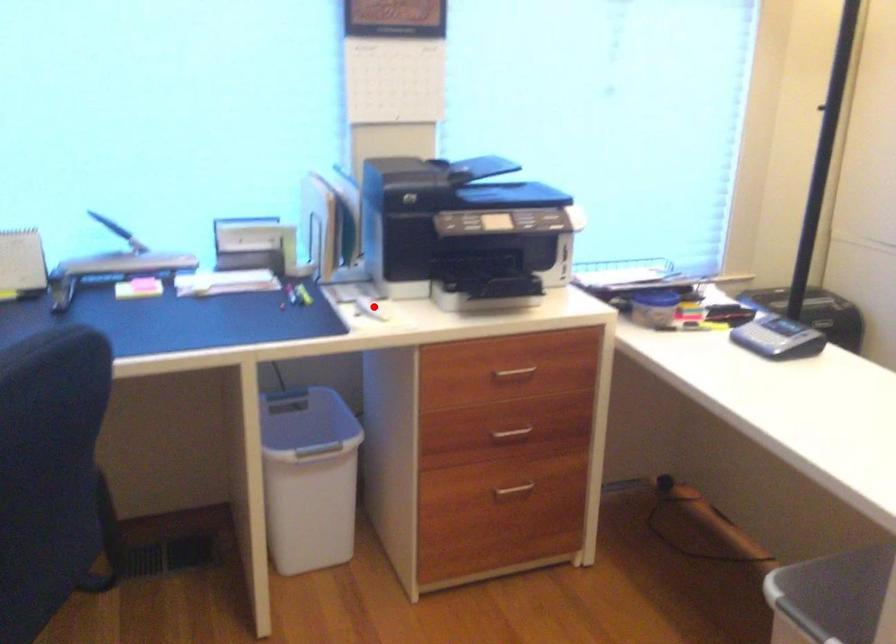
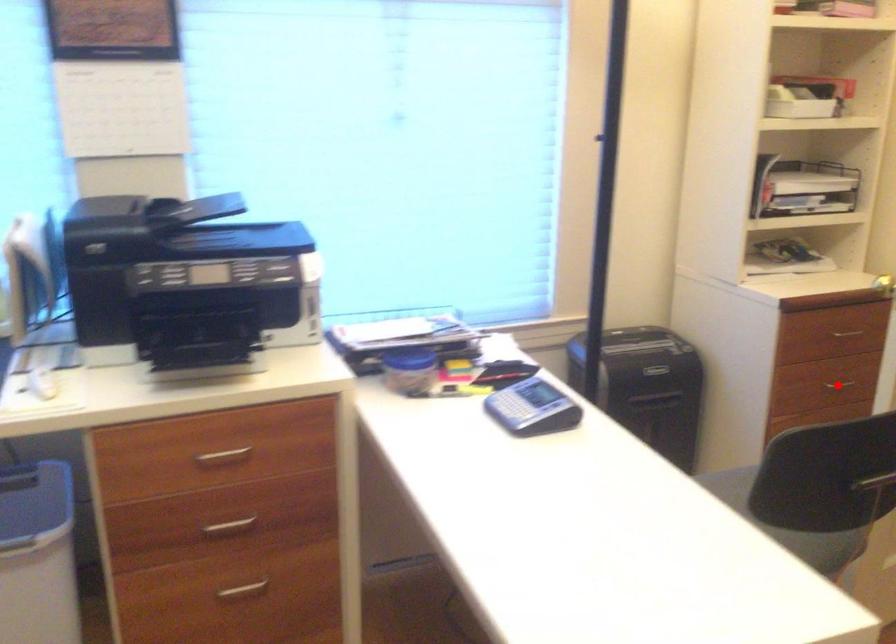
I am providing you with two images of the same scene from different viewpoints. A red point is marked on the first image and another point is marked on the second image. Is the marked point in image1 the same physical position as the marked point in image2?

No